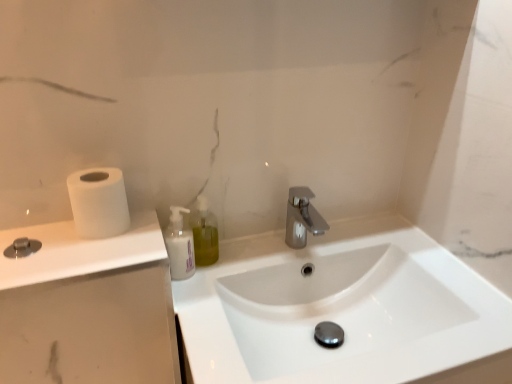
Identify the location of unoccupied region to the right of translucent plastic soap dispenser at center. (251, 250).